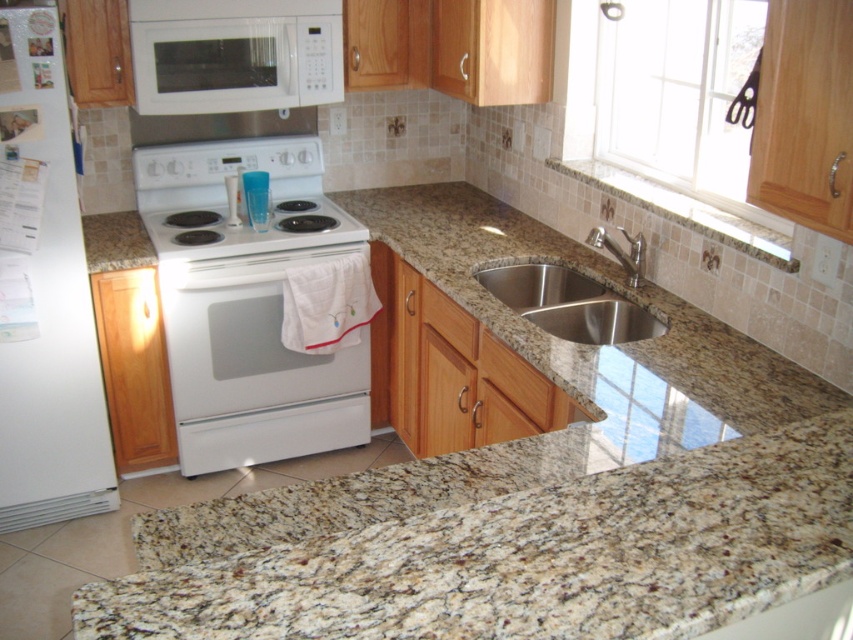
You are a professional chef preparing to install a new kitchen appliance. You have a new microwave that requires a minimum of 60 cm of clearance above it for safety. Looking at the kitchen layout, can the white glossy exhaust hood at upper center provide sufficient clearance above the white glossy electric stove at center?

The white glossy electric stove at center is much taller than the white glossy exhaust hood at upper center, so the clearance between them may not meet the required 60 cm. Check the actual measurements to ensure compliance with safety standards.

You are a kitchen designer planning to install a new appliance in the kitchen. You have a space that can accommodate the size of the silver metallic faucet at sink right. Can the white glossy exhaust hood at upper center fit into this space?

The white glossy exhaust hood at upper center is bigger than the silver metallic faucet at sink right, so it cannot fit into the space designed for the faucet.